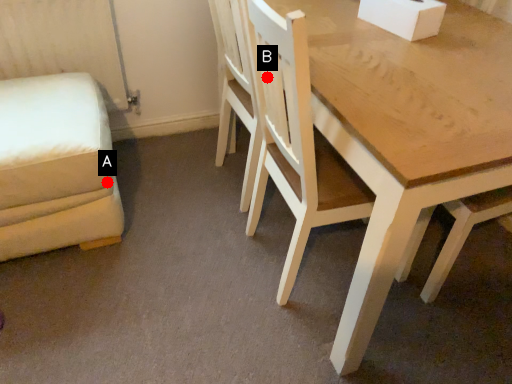
Question: Two points are circled on the image, labeled by A and B beside each circle. Which point appears closest to the camera in this image?

Choices:
 (A) A is closer
 (B) B is closer

Answer: (B)